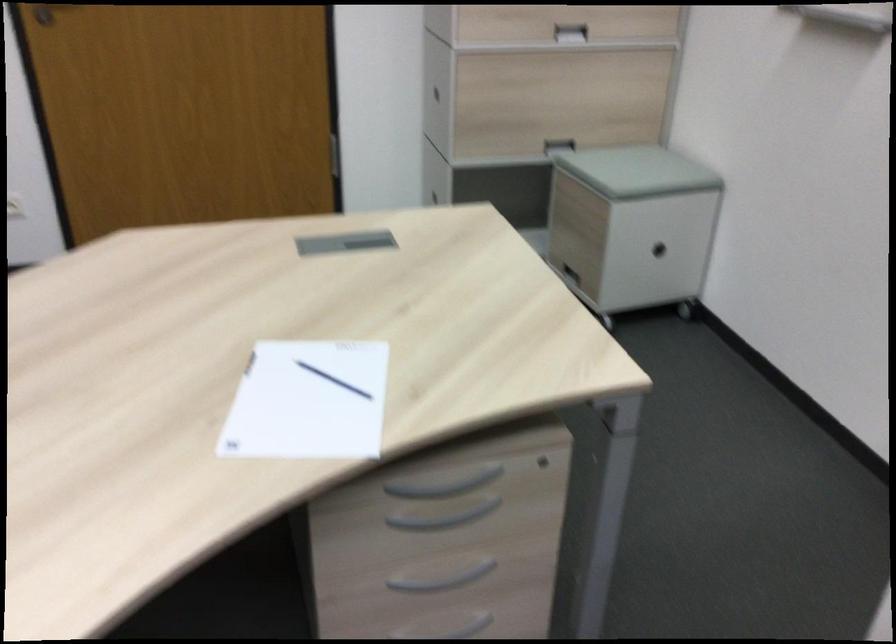
What do you see at coordinates (638, 171) in the screenshot? The width and height of the screenshot is (896, 644). I see `a stool sitting surface` at bounding box center [638, 171].